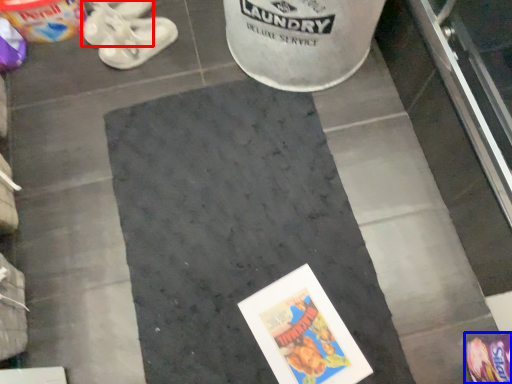
Question: Among these objects, which one is nearest to the camera, footwear (highlighted by a red box) or footwear (highlighted by a blue box)?

Choices:
 (A) footwear
 (B) footwear

Answer: (B)